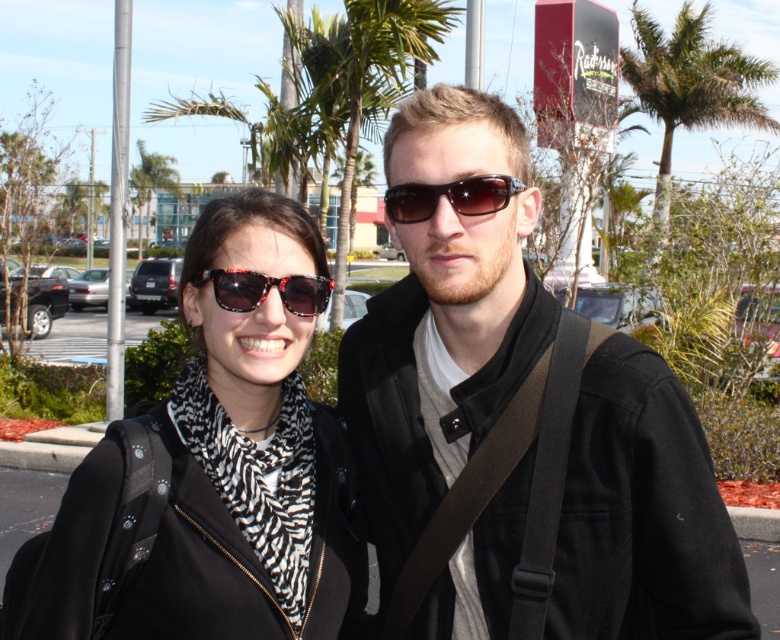
Question: Based on their relative distances, which object is farther from the shiny black sunglasses at center?

Choices:
 (A) black plastic sunglasses at center
 (B) zebra-patterned scarf at left
 (C) matte black jacket at center

Answer: (C)

Question: Is matte black jacket at center thinner than green leafy palm tree at upper center?

Choices:
 (A) yes
 (B) no

Answer: (A)

Question: Which object is the closest to the zebra-patterned scarf at left?

Choices:
 (A) black plastic sunglasses at center
 (B) matte black jacket at center
 (C) green leafy palm tree at upper center
 (D) shiny black sunglasses at center

Answer: (D)

Question: Does zebra-patterned scarf at left appear on the right side of black plastic sunglasses at center?

Choices:
 (A) no
 (B) yes

Answer: (A)

Question: Does zebra-patterned scarf at left appear under shiny black sunglasses at center?

Choices:
 (A) yes
 (B) no

Answer: (A)

Question: Which of the following is the closest to the observer?

Choices:
 (A) (243, 493)
 (B) (314, 300)
 (C) (426, 186)
 (D) (722, 81)

Answer: (C)